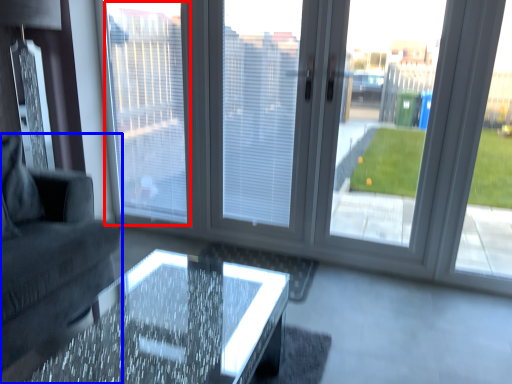
Question: Which object is closer to the camera taking this photo, window screen (highlighted by a red box) or studio couch (highlighted by a blue box)?

Choices:
 (A) window screen
 (B) studio couch

Answer: (B)